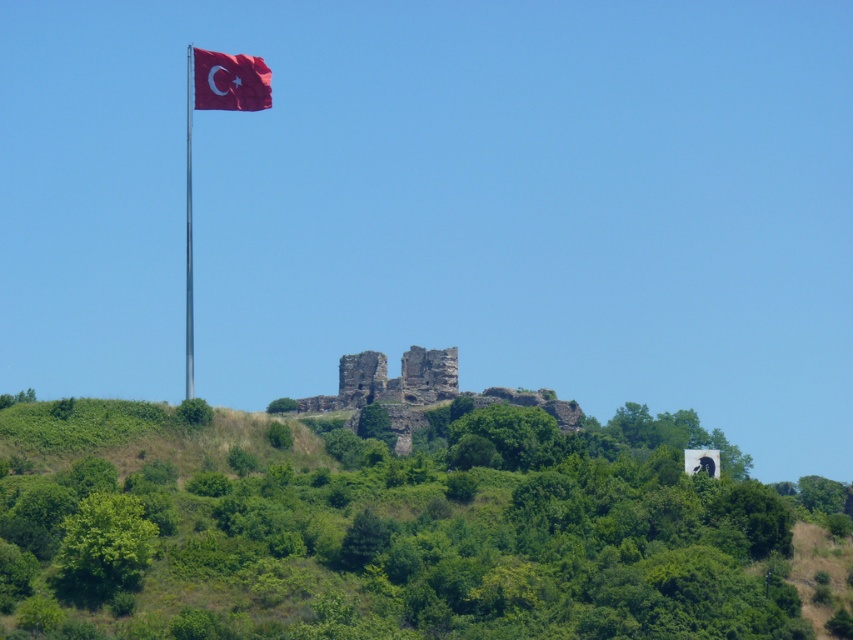
Find the location of a particular element. rustic stone castle at center is located at coordinates (390, 380).

Based on the photo, is rustic stone castle at center smaller than red fabric flag at upper left?

Correct, rustic stone castle at center occupies less space than red fabric flag at upper left.

What do you see at coordinates (390, 380) in the screenshot?
I see `rustic stone castle at center` at bounding box center [390, 380].

You are a GUI agent. You are given a task and a screenshot of the screen. Output one action in this format:
    pyautogui.click(x=<x>, y=<y>)
    Task: Click on the rustic stone castle at center
    
    Given the screenshot: What is the action you would take?
    point(390,380)

Which of these two, rustic stone castle at center or metallic flag pole at upper left, stands taller?

Standing taller between the two is metallic flag pole at upper left.

Does rustic stone castle at center appear on the left side of metallic flag pole at upper left?

No, rustic stone castle at center is not to the left of metallic flag pole at upper left.

Consider the image. Who is more distant from viewer, (457, 387) or (192, 310)?

The point (192, 310) is more distant.

Find the location of a particular element. The width and height of the screenshot is (853, 640). rustic stone castle at center is located at coordinates (390, 380).

Between point (380, 596) and point (228, 80), which one is positioned in front?

Positioned in front is point (380, 596).

Does green leafy hillside at center appear on the right side of red fabric flag at upper left?

Indeed, green leafy hillside at center is positioned on the right side of red fabric flag at upper left.

The width and height of the screenshot is (853, 640). I want to click on green leafy hillside at center, so click(x=387, y=540).

Find the location of a particular element. The height and width of the screenshot is (640, 853). green leafy hillside at center is located at coordinates (387, 540).